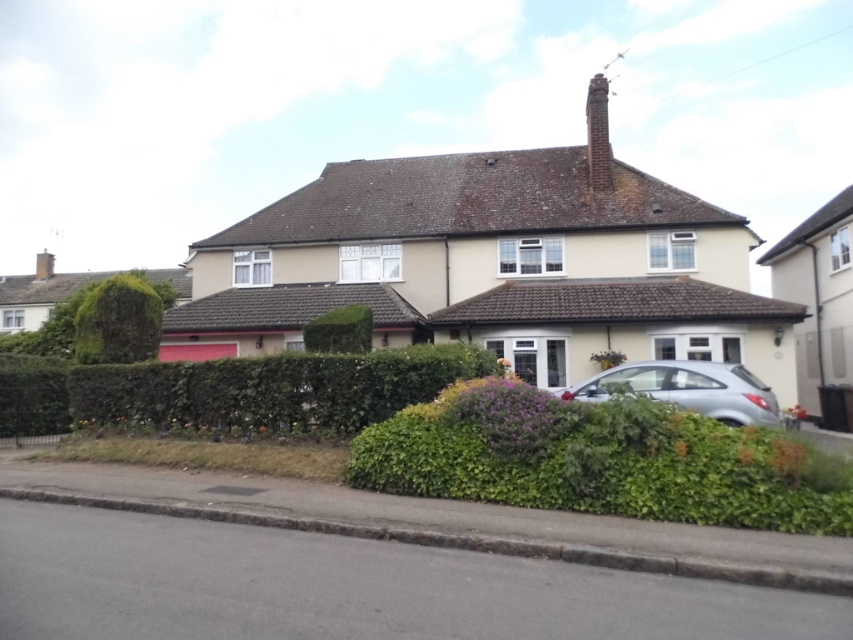
Question: Where is satin silver car at right located in relation to green leafy bush at left in the image?

Choices:
 (A) above
 (B) below

Answer: (B)

Question: Can you confirm if satin silver car at right is thinner than green leafy bush at center?

Choices:
 (A) yes
 (B) no

Answer: (B)

Question: Observing the image, what is the correct spatial positioning of green leafy hedge at center in reference to satin silver car at right?

Choices:
 (A) above
 (B) below

Answer: (B)

Question: Which of the following is the farthest from the observer?

Choices:
 (A) green leafy bush at left
 (B) brick chimney at upper center

Answer: (B)

Question: Which point is farther from the camera taking this photo?

Choices:
 (A) (717, 378)
 (B) (310, 348)
 (C) (134, 337)

Answer: (C)

Question: Which of the following is the closest to the observer?

Choices:
 (A) green leafy bush at center
 (B) green leafy bush at left

Answer: (A)